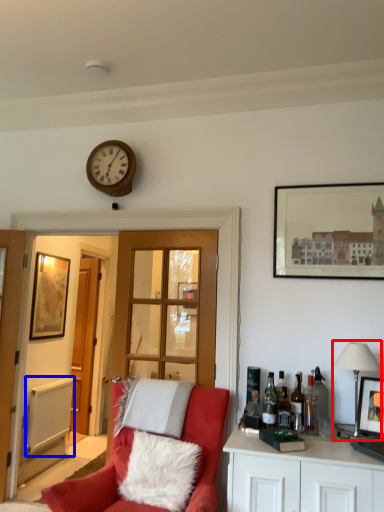
Question: Among these objects, which one is farthest to the camera, lamp (highlighted by a red box) or radiator (highlighted by a blue box)?

Choices:
 (A) lamp
 (B) radiator

Answer: (B)